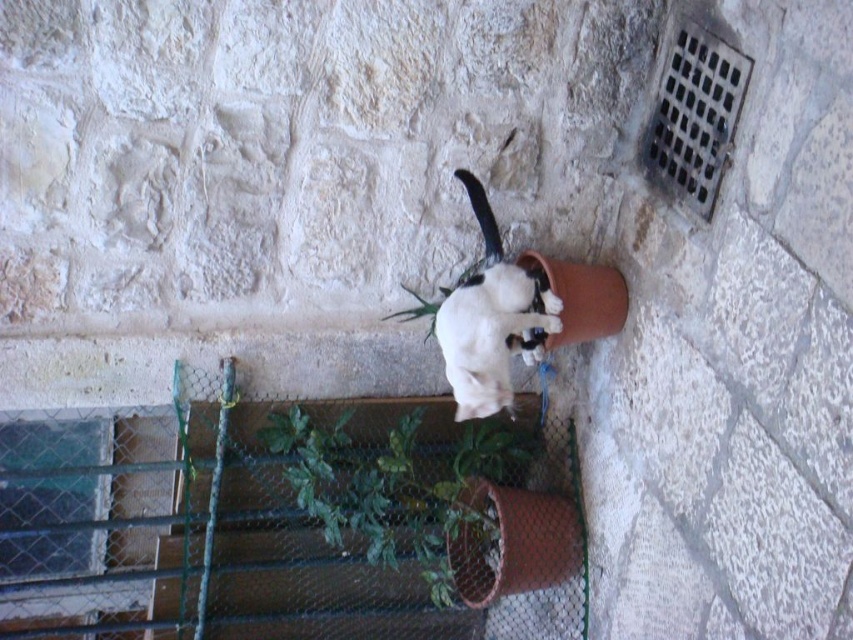
Question: Does green mesh fence at lower left have a lesser width compared to green textured plant at center?

Choices:
 (A) yes
 (B) no

Answer: (B)

Question: Does green mesh fence at lower left appear over green textured plant at center?

Choices:
 (A) yes
 (B) no

Answer: (B)

Question: Among these objects, which one is nearest to the camera?

Choices:
 (A) white fur cat at center
 (B) green mesh fence at lower left
 (C) green textured plant at center

Answer: (A)

Question: Based on their relative distances, which object is nearer to the green textured plant at center?

Choices:
 (A) white fur cat at center
 (B) green mesh fence at lower left

Answer: (B)

Question: Is green mesh fence at lower left bigger than green textured plant at center?

Choices:
 (A) yes
 (B) no

Answer: (A)

Question: Which of the following is the closest to the observer?

Choices:
 (A) (451, 580)
 (B) (483, 433)
 (C) (483, 412)

Answer: (C)